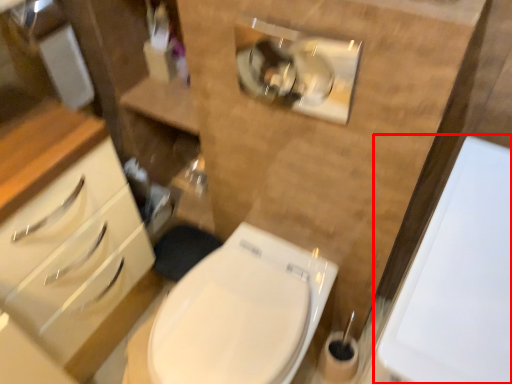
Question: From the image's perspective, where is porcelain (annotated by the red box) located relative to toilet?

Choices:
 (A) above
 (B) below

Answer: (A)